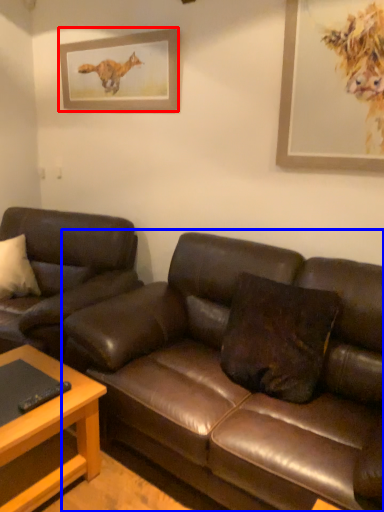
Question: Which object appears closest to the camera in this image, picture frame (highlighted by a red box) or studio couch (highlighted by a blue box)?

Choices:
 (A) picture frame
 (B) studio couch

Answer: (B)